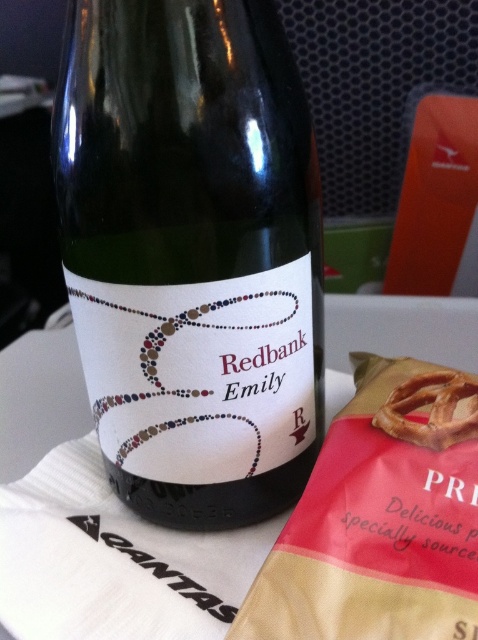
You are a delivery person who needs to place a new golden brown pretzel at center next to the green glass bottle at center. The minimum distance required between items for safety is 12 inches. Can you place it there?

The green glass bottle at center is currently 10.39 inches from the golden brown pretzel at center, which is less than the required 12 inches. Therefore, you cannot place the golden brown pretzel at center there due to insufficient spacing.